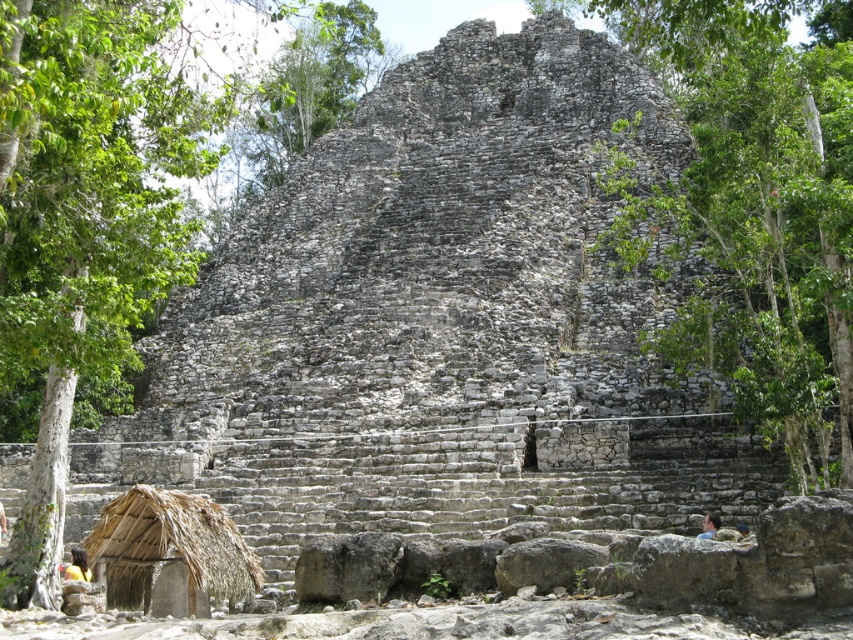
Who is positioned more to the right, green leafy tree at center or green leafy tree at center-left?

green leafy tree at center is more to the right.

Is the position of green leafy tree at center more distant than that of green leafy tree at center-left?

Yes.

At what (x,y) coordinates should I click in order to perform the action: click on green leafy tree at center. Please return your answer as a coordinate pair (x, y). The image size is (853, 640). Looking at the image, I should click on (749, 205).

The width and height of the screenshot is (853, 640). I want to click on green leafy tree at center, so click(x=749, y=205).

Based on the photo, is the position of green leafy tree at center-left less distant than that of brown thatch hut at lower left?

Yes.

Does point (49, 56) come behind point (235, 544)?

That is False.

Locate an element on the screen. green leafy tree at center-left is located at coordinates (84, 225).

Who is more forward, [850,401] or [97,547]?

Point [97,547] is in front.

Is point (762, 148) positioned after point (215, 552)?

Yes.

I want to click on green leafy tree at center, so click(x=749, y=205).